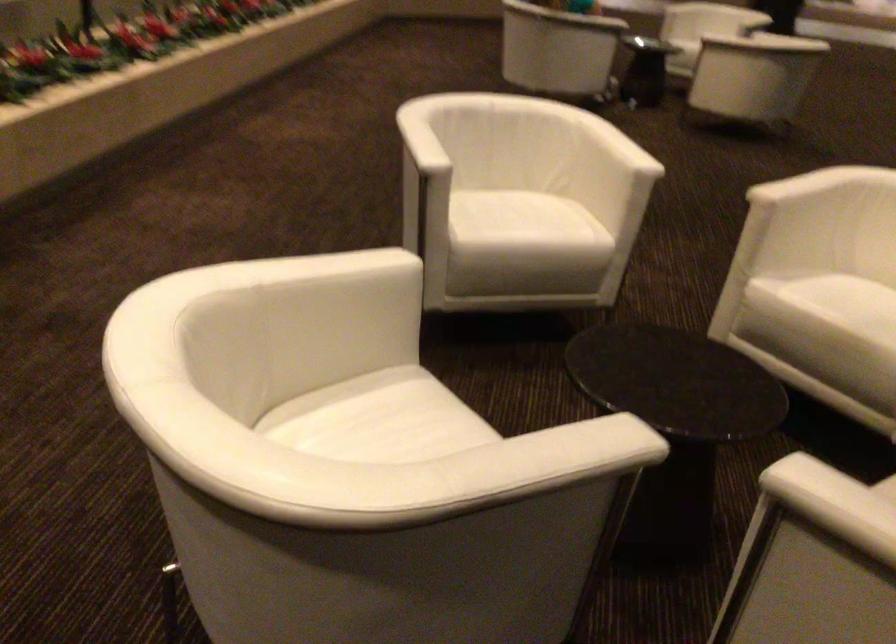
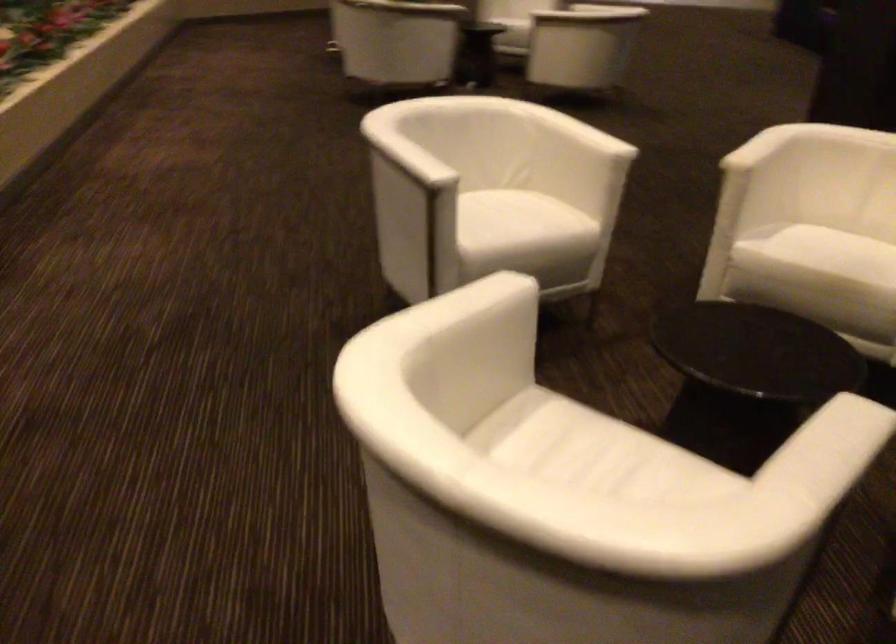
The point at (515, 212) is marked in the first image. Where is the corresponding point in the second image?

(502, 214)